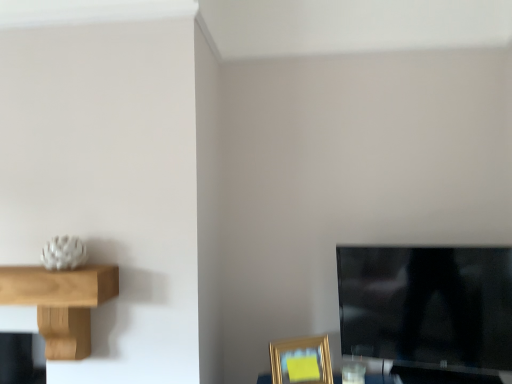
Question: In terms of size, does gold metallic picture frame at lower right appear bigger or smaller than black glossy tv at lower right?

Choices:
 (A) small
 (B) big

Answer: (A)

Question: Looking at their shapes, would you say gold metallic picture frame at lower right is wider or thinner than black glossy tv at lower right?

Choices:
 (A) thin
 (B) wide

Answer: (A)

Question: Which is farther from the light brown wooden shelf at left?

Choices:
 (A) black glossy tv at lower right
 (B) gold metallic picture frame at lower right

Answer: (A)

Question: Which object is positioned closest to the black glossy tv at lower right?

Choices:
 (A) gold metallic picture frame at lower right
 (B) light brown wooden shelf at left

Answer: (A)